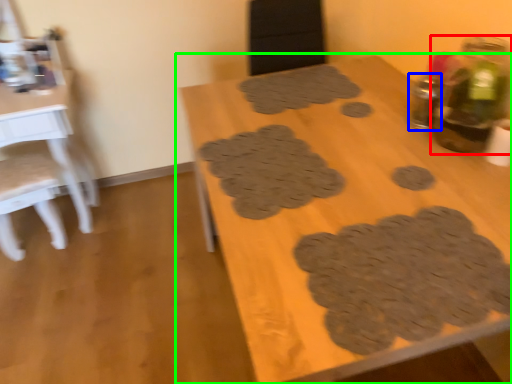
Question: Which object is positioned farthest from bottle (highlighted by a red box)? Select from bottle (highlighted by a blue box) and table (highlighted by a green box).

Choices:
 (A) bottle
 (B) table

Answer: (B)